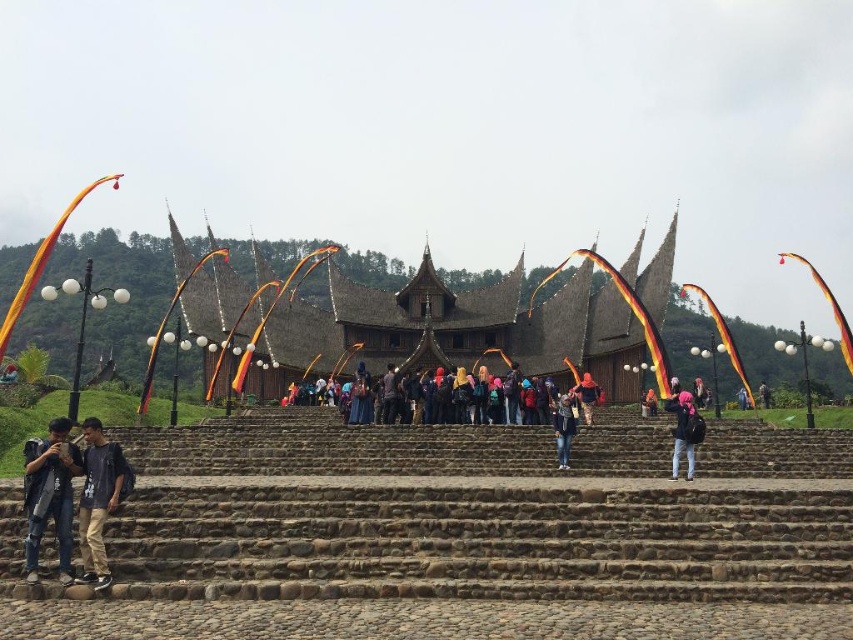
Is brown stone stairs at center closer to camera compared to pink fabric backpack at lower right?

Yes, brown stone stairs at center is in front of pink fabric backpack at lower right.

Is point (578, 518) positioned before point (698, 426)?

Yes, it is.

Where is `brown stone stairs at center`? This screenshot has height=640, width=853. brown stone stairs at center is located at coordinates (480, 513).

Between point (680, 394) and point (587, 406), which one is positioned behind?

Point (587, 406)

Is pink fabric backpack at lower right in front of matte orange headscarf at center?

Yes, it is.

Who is more forward, (675, 468) or (593, 403)?

Positioned in front is point (675, 468).

The image size is (853, 640). I want to click on pink fabric backpack at lower right, so click(683, 429).

Can you confirm if brown thatched roof at center is thinner than denim jacket at lower left?

In fact, brown thatched roof at center might be wider than denim jacket at lower left.

Who is higher up, brown thatched roof at center or denim jacket at lower left?

brown thatched roof at center

Does point (608, 349) lie behind point (30, 520)?

Yes, it is.

This screenshot has height=640, width=853. What are the coordinates of `brown thatched roof at center` in the screenshot? It's located at (456, 326).